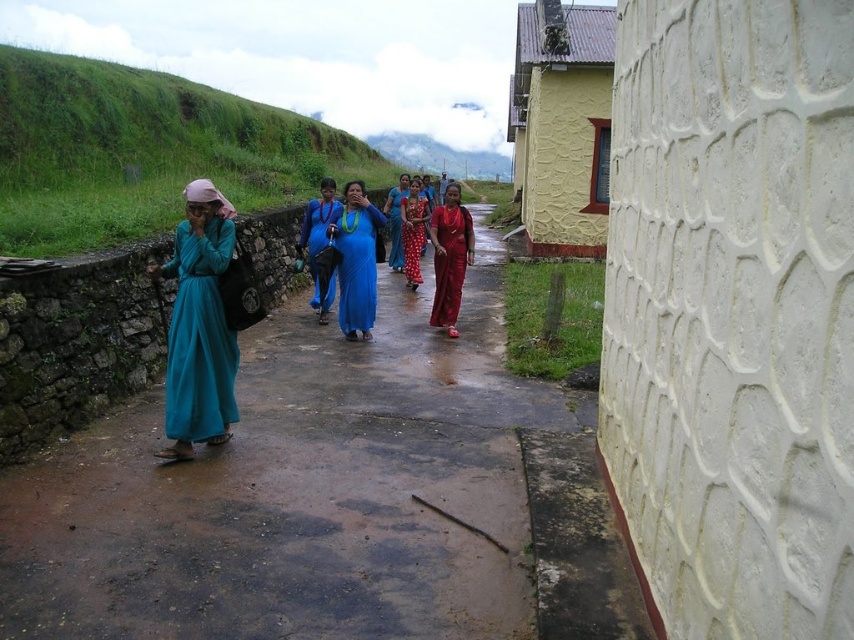
Question: Among these objects, which one is nearest to the camera?

Choices:
 (A) polka dot dress at center
 (B) shiny red dress at center
 (C) teal fabric dress at left

Answer: (C)

Question: Estimate the real-world distances between objects in this image. Which object is farther from the blue silk saree at center?

Choices:
 (A) blue fabric dress at center
 (B) polka dot dress at center

Answer: (A)

Question: From the image, what is the correct spatial relationship of teal fabric dress at left in relation to polka dot dress at center?

Choices:
 (A) below
 (B) above

Answer: (A)

Question: Where is dull concrete path at center located in relation to shiny red dress at center in the image?

Choices:
 (A) right
 (B) left

Answer: (A)

Question: Does blue fabric dress at center come behind blue silk saree at center?

Choices:
 (A) yes
 (B) no

Answer: (B)

Question: Which point is farther from the camera taking this photo?

Choices:
 (A) (180, 337)
 (B) (320, 241)
 (C) (361, 280)
 (D) (442, 284)

Answer: (B)